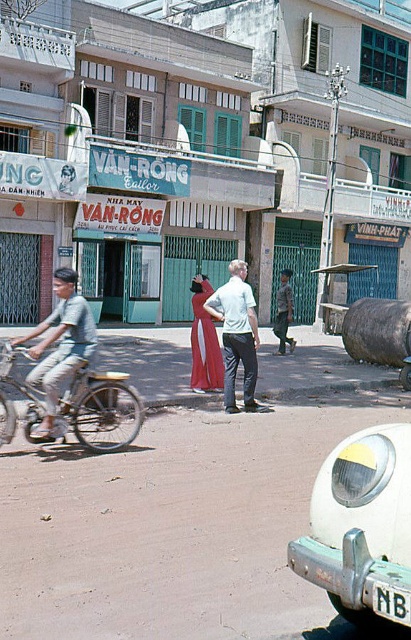
You are a delivery person standing at the entrance of the street. You need to park your scooter in a spot that is closest to the center of the street. Given the white matte scooter at lower right is currently at point 0.825, 0.881, can you determine if you should move it to a closer position to the center?

The white matte scooter at lower right is located at point (362, 528). Since the center of the street would be around coordinates like (205, 320), the scooter is positioned towards the lower right corner, so moving it closer to the center would require moving it towards the middle of the street.